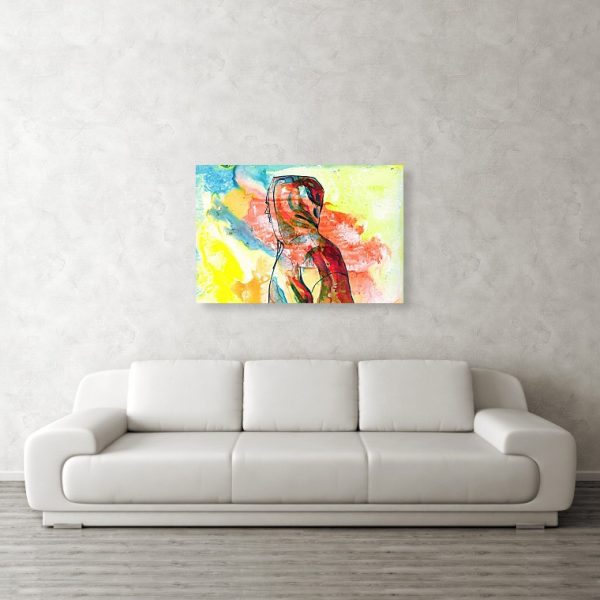
Where is `seat`? This screenshot has height=600, width=600. seat is located at coordinates (293, 447).